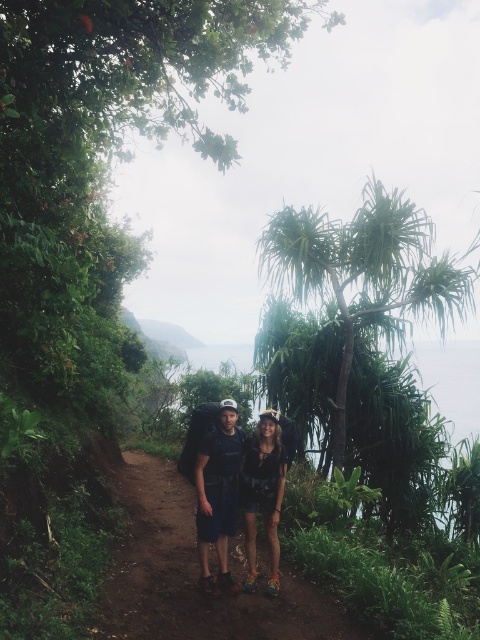
Is green leafy tree at center below matte black shorts at center?

No.

Identify the location of green leafy tree at center. The height and width of the screenshot is (640, 480). (364, 275).

Image resolution: width=480 pixels, height=640 pixels. Identify the location of green leafy tree at center. coord(364,275).

Which is behind, point (272, 529) or point (265, 499)?

The point (272, 529) is behind.

Between matte black backpack at center and matte black shorts at center, which one is positioned higher?

matte black backpack at center

Who is more distant from viewer, (242, 486) or (271, 506)?

The point (242, 486) is behind.

You are a GUI agent. You are given a task and a screenshot of the screen. Output one action in this format:
    pyautogui.click(x=<x>, y=<y>)
    Task: Click on the matte black backpack at center
    
    Given the screenshot: What is the action you would take?
    pyautogui.click(x=239, y=492)

Is point (424, 218) positioned before point (200, 563)?

No, it is not.

Does green leafy tree at center have a lesser width compared to matte black backpack at center?

In fact, green leafy tree at center might be wider than matte black backpack at center.

Between point (336, 280) and point (213, 536), which one is positioned in front?

Positioned in front is point (213, 536).

Locate an element on the screen. This screenshot has height=640, width=480. green leafy tree at center is located at coordinates (364, 275).